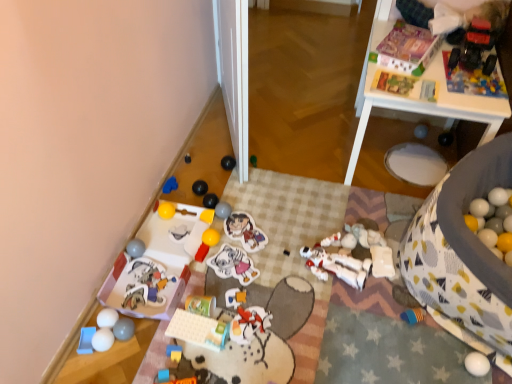
The width and height of the screenshot is (512, 384). I want to click on vacant space underneath rubberized plastic toy truck at upper right, which ranks as the 26th toy in left-to-right order (from a real-world perspective), so click(x=466, y=62).